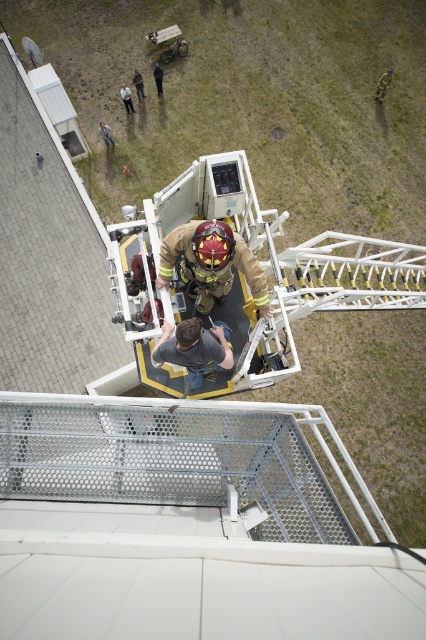
You are a maintenance worker needing to access the control panel. There are two people on the platform. Which individual is closer to the control panel, the firefighter uniform at center or the brown leather jacket at upper center?

The firefighter uniform at center is closer to the control panel because it is positioned under the brown leather jacket at upper center, indicating a lower and nearer position.

You are a maintenance worker needing to identify the taller object between the light brown leather jacket at upper center and the brushed metal helmet at upper center. Which one is taller?

The light brown leather jacket at upper center is not as tall as the brushed metal helmet at upper center, so the brushed metal helmet at upper center is taller.